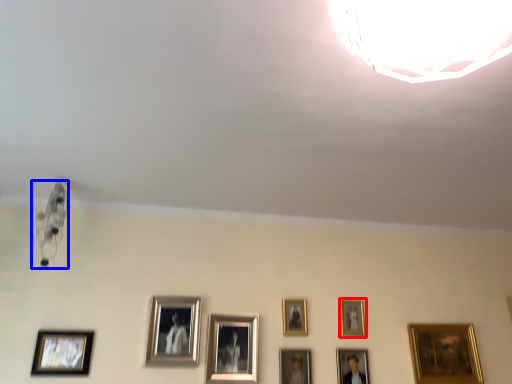
Question: Which object appears closest to the camera in this image, picture frame (highlighted by a red box) or lamp (highlighted by a blue box)?

Choices:
 (A) picture frame
 (B) lamp

Answer: (B)